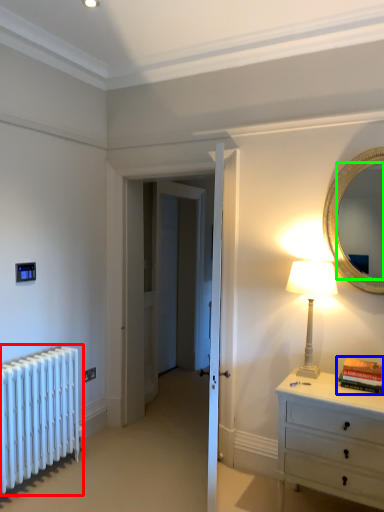
Question: Which object is positioned farthest from radiator (highlighted by a red box)? Select from book (highlighted by a blue box) and mirror (highlighted by a green box).

Choices:
 (A) book
 (B) mirror

Answer: (B)